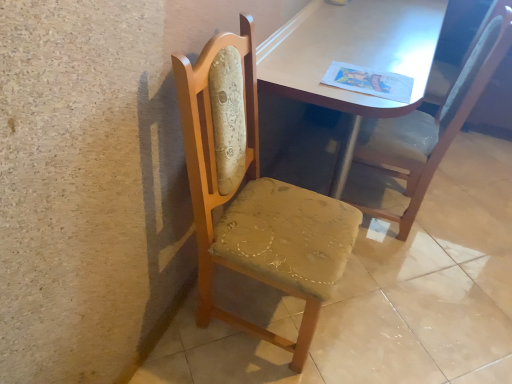
At what (x,y) coordinates should I click in order to perform the action: click on free point to the right of woodenchair at left, the 2th chair in the right-to-left sequence. Please return your answer as a coordinate pair (x, y). This screenshot has height=384, width=512. Looking at the image, I should click on (377, 323).